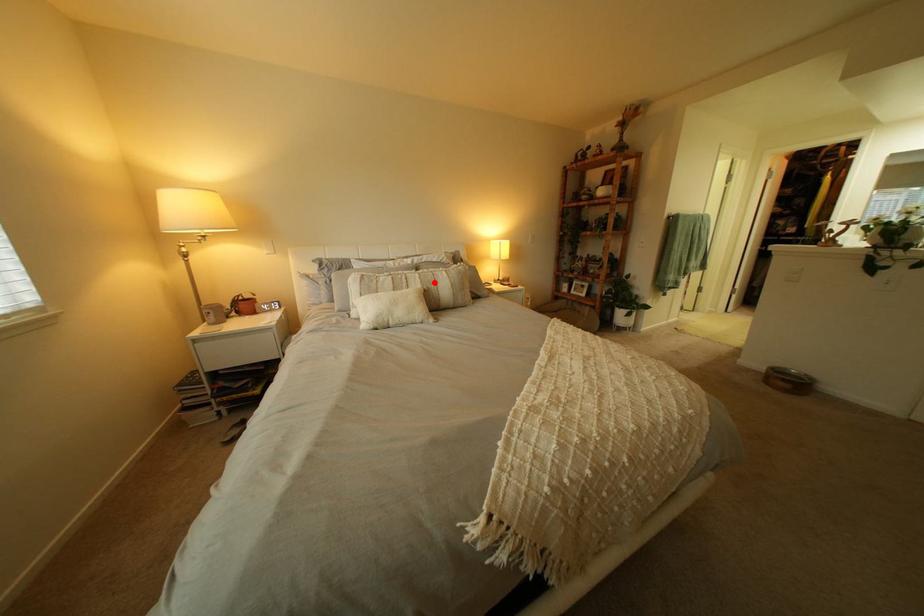
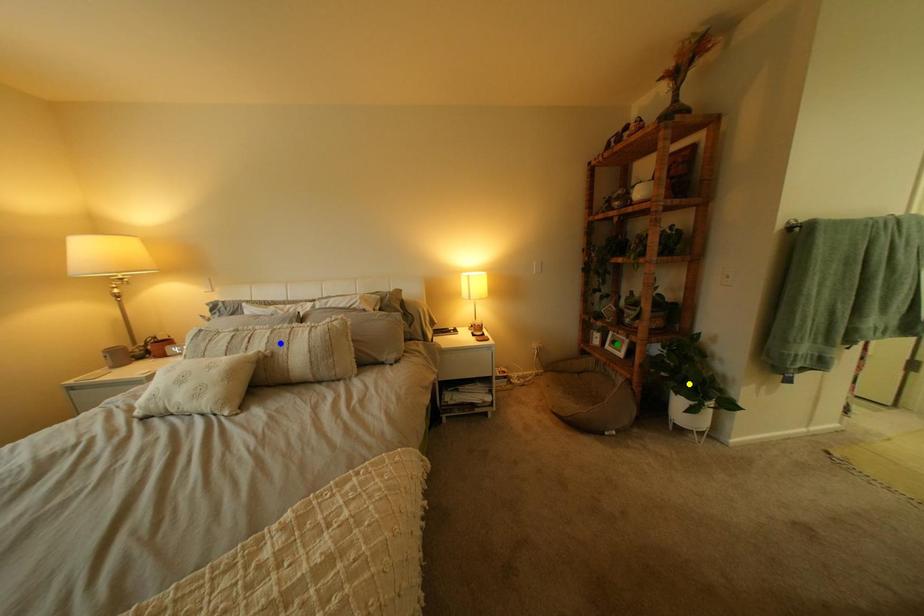
Question: I am providing you with two images of the same scene from different viewpoints. A red point is marked on the first image. You are given multiple points on the second image. In image 2, which mark is for the same physical point as the one in image 1?

Choices:
 (A) green point
 (B) yellow point
 (C) blue point

Answer: (C)